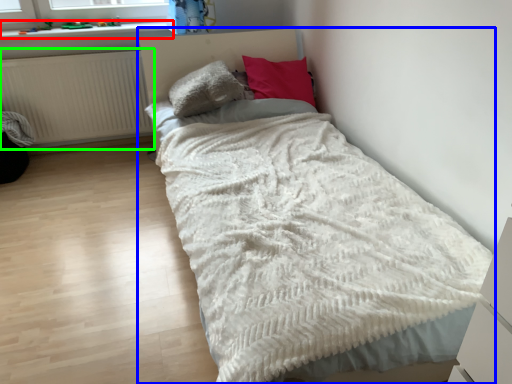
Question: Based on their relative distances, which object is farther from window sill (highlighted by a red box)? Choose from bed (highlighted by a blue box) and radiator (highlighted by a green box).

Choices:
 (A) bed
 (B) radiator

Answer: (A)